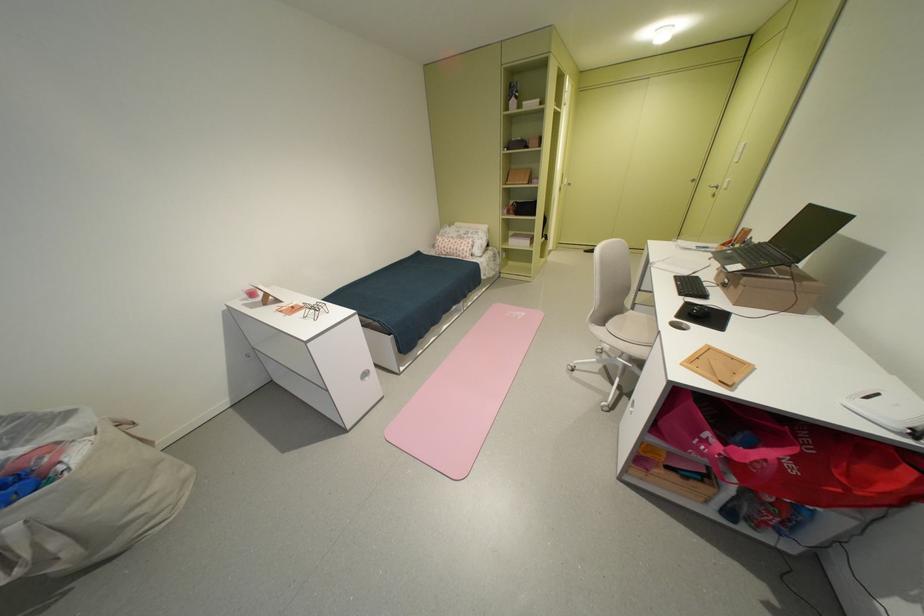
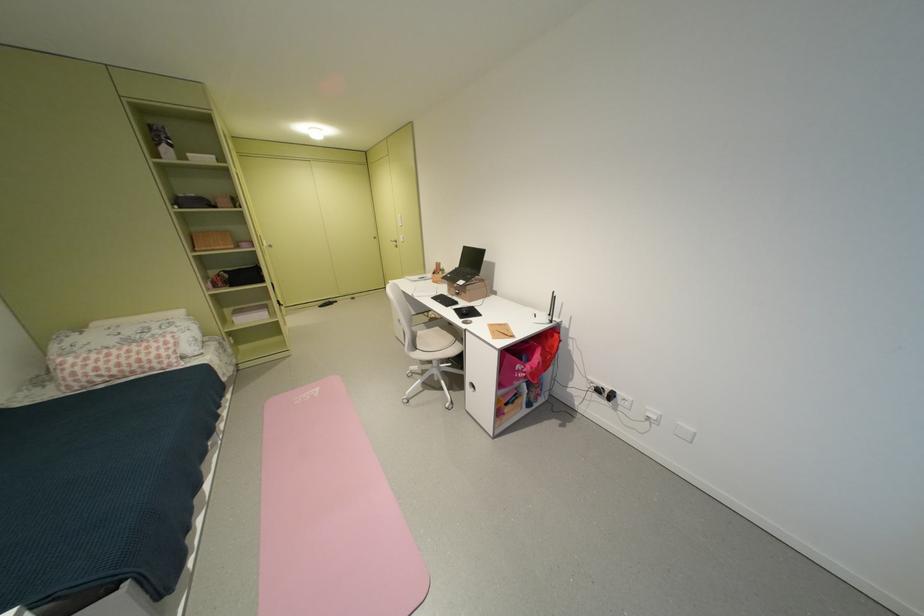
Locate, in the second image, the point that corresponds to the point at 703,180 in the first image.

(383, 238)